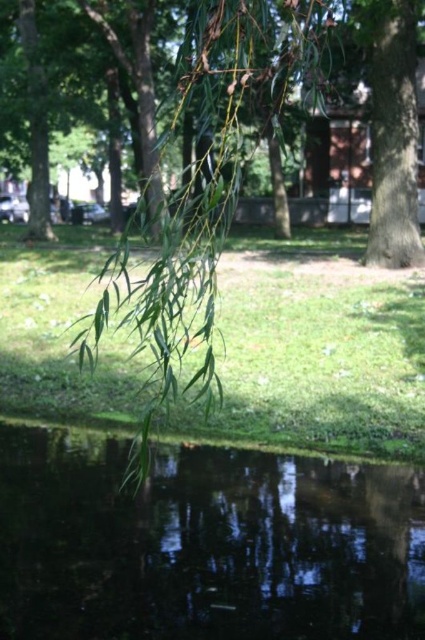
Question: Among these points, which one is nearest to the camera?

Choices:
 (A) (33, 339)
 (B) (70, 49)
 (C) (73, 604)

Answer: (C)

Question: Which point is farther to the camera?

Choices:
 (A) (295, 484)
 (B) (133, 390)
 (C) (399, 122)

Answer: (C)

Question: Is transparent liquid water at lower center to the left of green leafy branch at lower left from the viewer's perspective?

Choices:
 (A) yes
 (B) no

Answer: (A)

Question: Among these objects, which one is nearest to the camera?

Choices:
 (A) green leafy grass at center
 (B) transparent liquid water at lower center

Answer: (B)

Question: Does green leafy grass at center have a smaller size compared to green leafy branch at lower left?

Choices:
 (A) no
 (B) yes

Answer: (B)

Question: Does green leafy grass at center come in front of green leafy branch at lower left?

Choices:
 (A) no
 (B) yes

Answer: (A)